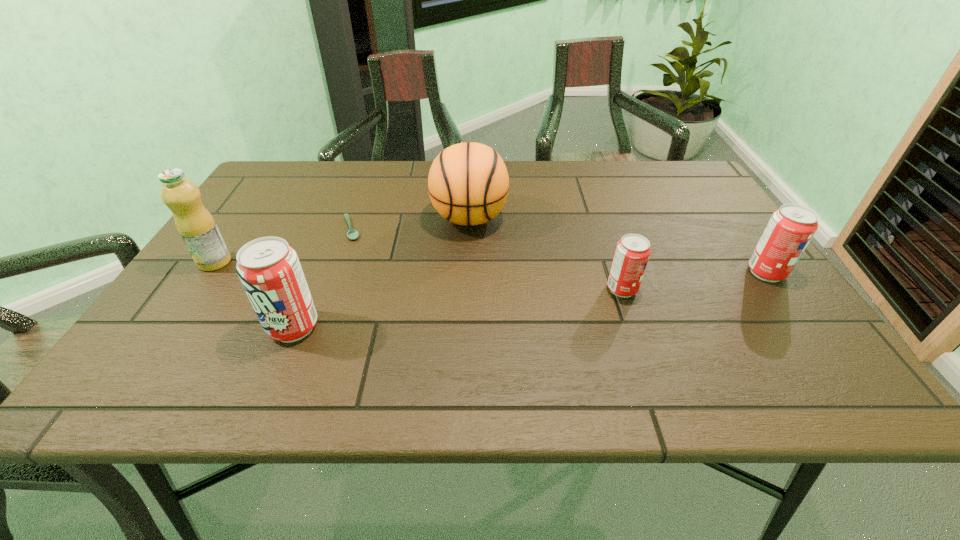
You are a GUI agent. You are given a task and a screenshot of the screen. Output one action in this format:
    pyautogui.click(x=<x>, y=<y>)
    Task: Click on the nearest object
    This screenshot has height=540, width=960.
    Given the screenshot: What is the action you would take?
    [x=269, y=269]

Where is `the leftmost soda can`? the leftmost soda can is located at coordinates (269, 269).

This screenshot has width=960, height=540. Find the location of `the shortest soda can`. the shortest soda can is located at coordinates (632, 253).

Locate an element on the screen. Image resolution: width=960 pixels, height=540 pixels. the fifth object from left to right is located at coordinates (632, 253).

In order to click on the second tallest soda can in this screenshot , I will do `click(790, 229)`.

Where is `the rightmost object`? Image resolution: width=960 pixels, height=540 pixels. the rightmost object is located at coordinates (790, 229).

Find the location of a particular element. Image resolution: width=960 pixels, height=540 pixels. basketball is located at coordinates (468, 183).

Identify the location of fruit juice. The image size is (960, 540). (195, 224).

I want to click on soupspoon, so click(352, 234).

This screenshot has width=960, height=540. In order to click on vacant region located 0.180m on the back of the nearest soda can in this screenshot , I will do `click(324, 255)`.